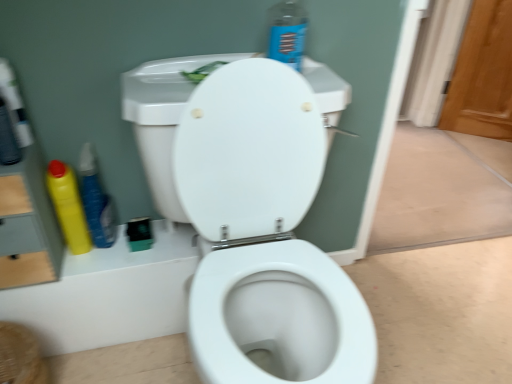
Question: Does yellow plastic bottle at left, arranged as the second cleaning product when viewed from the right, have a lesser width compared to wooden screen door at right?

Choices:
 (A) no
 (B) yes

Answer: (B)

Question: Is yellow plastic bottle at left, arranged as the second cleaning product when viewed from the right, oriented towards wooden screen door at right?

Choices:
 (A) yes
 (B) no

Answer: (B)

Question: From the image's perspective, does yellow plastic bottle at left, which ranks as the second cleaning product in left-to-right order, appear lower than wooden screen door at right?

Choices:
 (A) yes
 (B) no

Answer: (A)

Question: From the image's perspective, does yellow plastic bottle at left, which ranks as the second cleaning product in left-to-right order, appear higher than wooden screen door at right?

Choices:
 (A) no
 (B) yes

Answer: (A)

Question: Is yellow plastic bottle at left, which ranks as the second cleaning product in left-to-right order, to the left of wooden screen door at right from the viewer's perspective?

Choices:
 (A) no
 (B) yes

Answer: (B)

Question: From the image's perspective, is yellow plastic bottle at left, the 1th cleaning product in the left-to-right sequence, located above or below wooden screen door at right?

Choices:
 (A) below
 (B) above

Answer: (A)

Question: In terms of width, does yellow plastic bottle at left, which appears as the 3th cleaning product when viewed from the right, look wider or thinner when compared to wooden screen door at right?

Choices:
 (A) wide
 (B) thin

Answer: (B)

Question: Do you think yellow plastic bottle at left, the 1th cleaning product in the left-to-right sequence, is within wooden screen door at right, or outside of it?

Choices:
 (A) outside
 (B) inside

Answer: (A)

Question: Considering their positions, is yellow plastic bottle at left, which appears as the 3th cleaning product when viewed from the right, located in front of or behind wooden screen door at right?

Choices:
 (A) front
 (B) behind

Answer: (A)

Question: Visually, is wooden screen door at right positioned to the left or to the right of yellow plastic bottle at left, which appears as the 3th cleaning product when viewed from the right?

Choices:
 (A) left
 (B) right

Answer: (B)

Question: Is wooden screen door at right wider or thinner than yellow plastic bottle at left, the 1th cleaning product in the left-to-right sequence?

Choices:
 (A) wide
 (B) thin

Answer: (A)

Question: From a real-world perspective, relative to yellow plastic bottle at left, which appears as the 3th cleaning product when viewed from the right, is wooden screen door at right vertically above or below?

Choices:
 (A) below
 (B) above

Answer: (A)

Question: Considering their positions, is wooden screen door at right located in front of or behind yellow plastic bottle at left, the 1th cleaning product in the left-to-right sequence?

Choices:
 (A) front
 (B) behind

Answer: (B)

Question: Does point (490, 105) appear closer or farther from the camera than point (95, 216)?

Choices:
 (A) farther
 (B) closer

Answer: (A)

Question: From a real-world perspective, relative to yellow plastic bottle at left, which ranks as the second cleaning product in left-to-right order, is wooden screen door at right vertically above or below?

Choices:
 (A) below
 (B) above

Answer: (A)